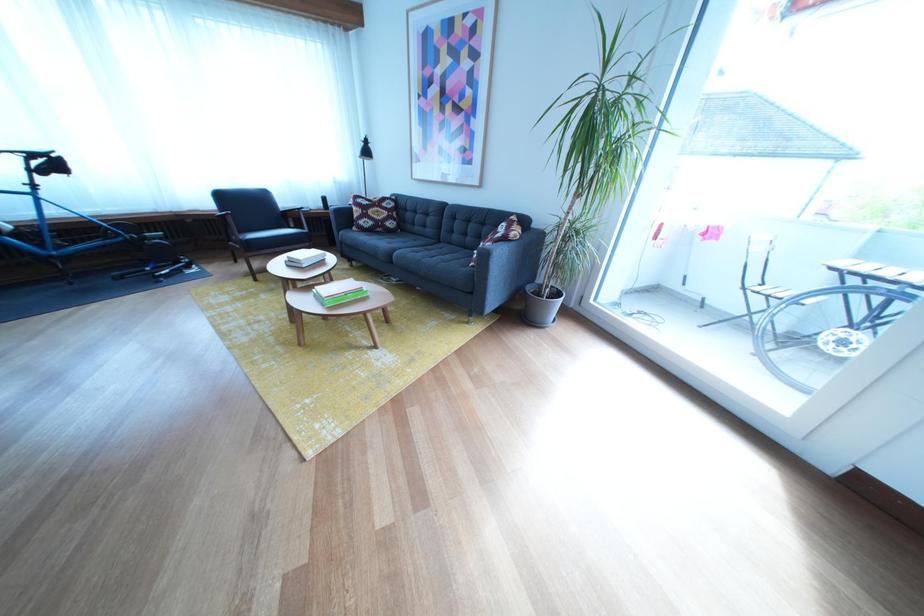
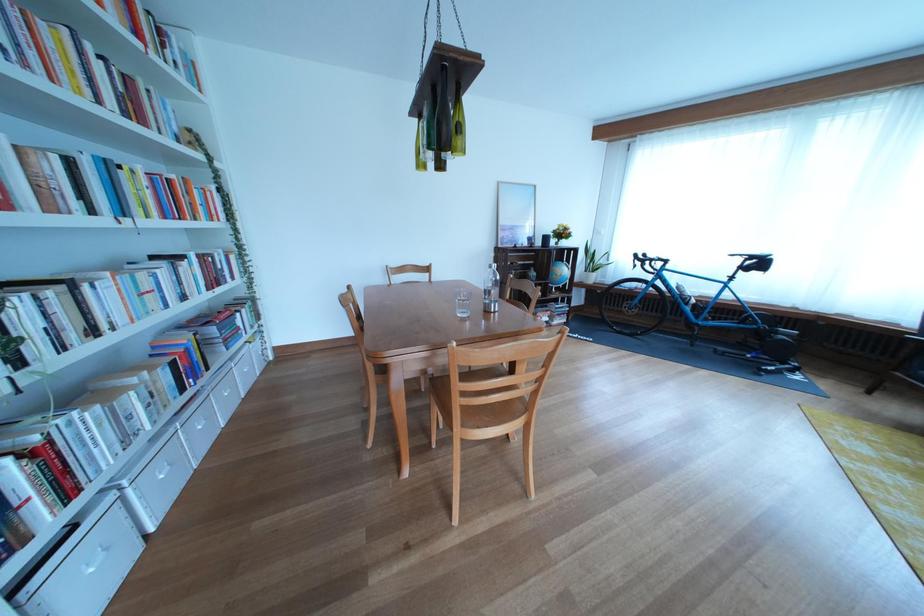
Question: The camera is either moving clockwise (left) or counter-clockwise (right) around the object. The first image is from the beginning of the video and the second image is from the end. Is the camera moving left or right when shooting the video?

Choices:
 (A) Left
 (B) Right

Answer: (B)